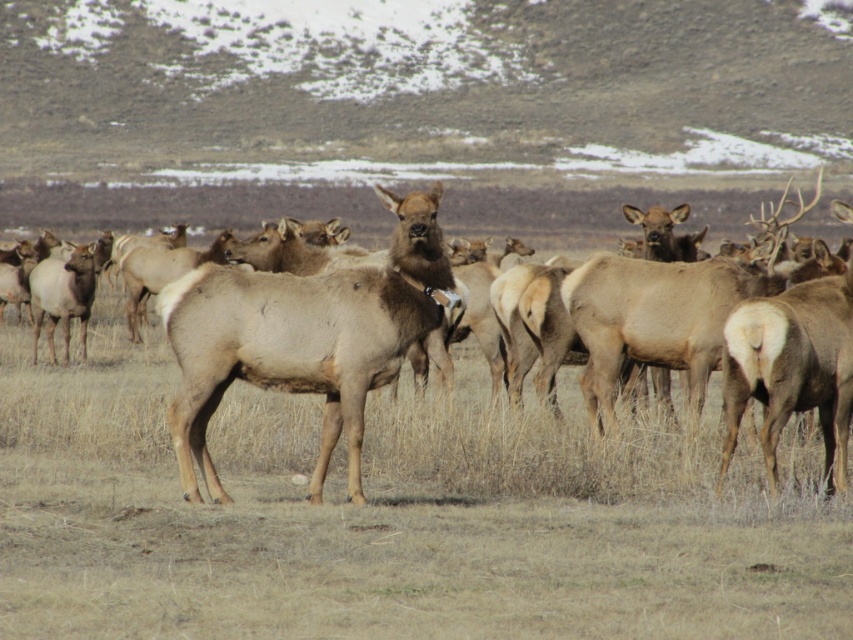
From the picture: You are standing at the camera position and want to reach the point marked at coordinates (25,394). If you walk straight ahead, how far will you have to walk to reach that point?

The point marked at coordinates (25,394) is 42.63 feet away from the camera, so you will have to walk 42.63 feet straight ahead to reach it.